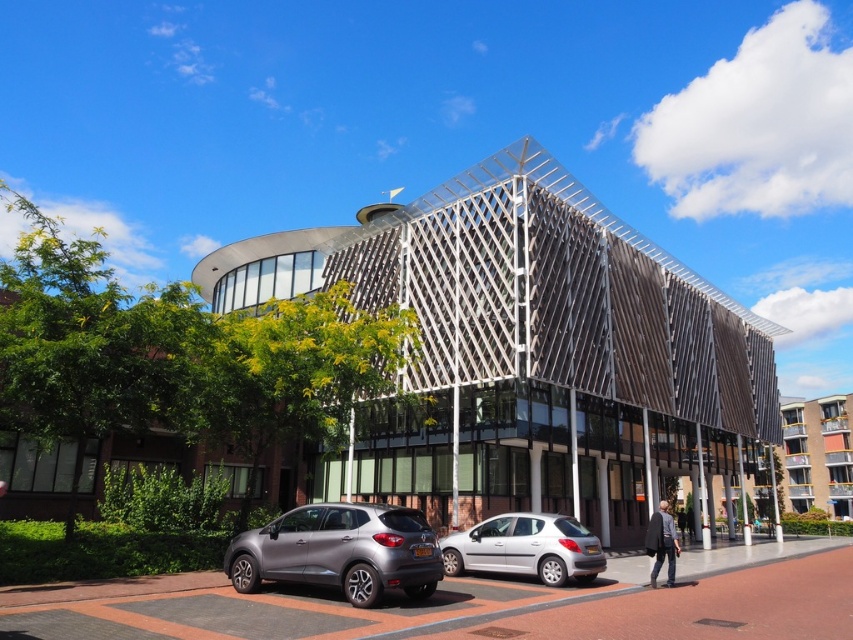
You are a delivery driver who needs to park your truck between the silver metallic hatchback at center and the smaller silver car. The truck is 12 meters long. Can you fit your truck in the space between them?

The space between the silver metallic hatchback at center and the smaller silver car is 13.48 meters, so yes, the truck can fit as it is shorter than the available space.

Based on the photo, you are standing in front of the modern architectural structure. You notice the wooden lattice structure at center and the gray concrete building at center. Which one appears larger in size?

The wooden lattice structure at center is bigger than the gray concrete building at center, so it appears larger in size.

You are standing in front of the modern architectural structure and want to take a photo of the gray concrete building at center without the wooden lattice structure at center blocking the view. Is this possible?

The wooden lattice structure at center is in front of the gray concrete building at center, so it will block the view. To capture the gray concrete building at center without obstruction, you would need to move to a position where the wooden lattice structure at center is not between you and the building.